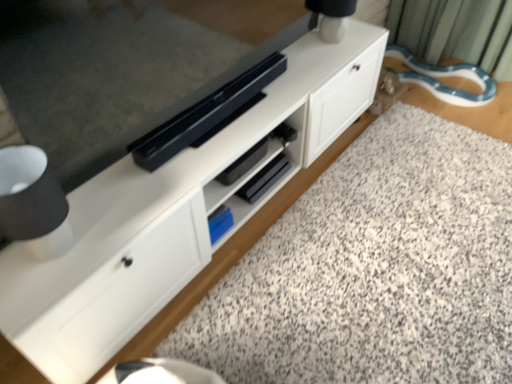
You are a GUI agent. You are given a task and a screenshot of the screen. Output one action in this format:
    pyautogui.click(x=<x>, y=<y>)
    Task: Click on the vacant space in front of white matte table lamp at upper right
    
    Given the screenshot: What is the action you would take?
    pyautogui.click(x=336, y=61)